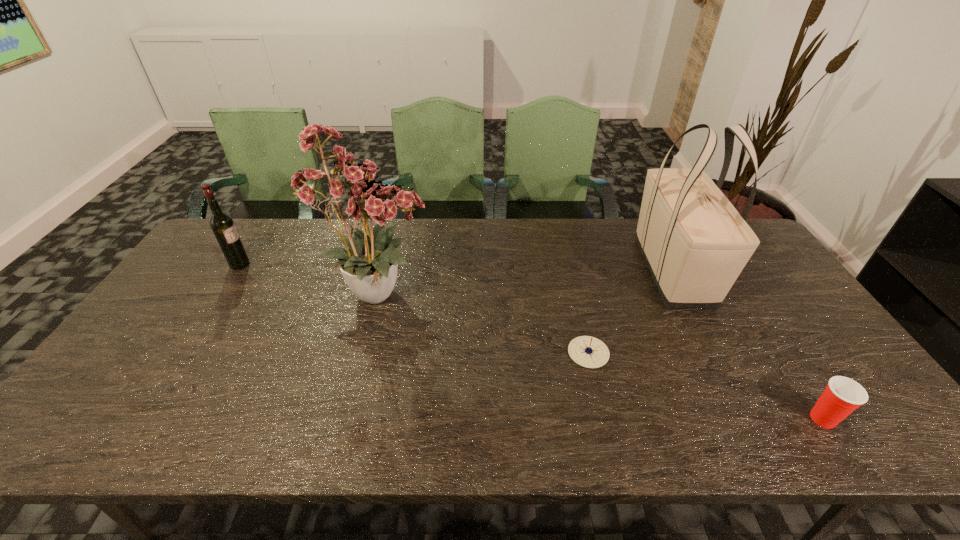
At what (x,y) coordinates should I click in order to perform the action: click on unoccupied position between the third object from left to right and the shopping bag. Please return your answer as a coordinate pair (x, y). The height and width of the screenshot is (540, 960). Looking at the image, I should click on (631, 312).

Identify the location of unoccupied position between the leftmost object and the shopping bag. (456, 268).

Find the location of a particular element. Image resolution: width=960 pixels, height=540 pixels. vacant area that lies between the flower arrangement and the second object from right to left is located at coordinates (527, 282).

Identify which object is located as the third nearest to the flower arrangement. Please provide its 2D coordinates. Your answer should be formatted as a tuple, i.e. [(x, y)], where the tuple contains the x and y coordinates of a point satisfying the conditions above.

[(695, 243)]

Image resolution: width=960 pixels, height=540 pixels. What are the coordinates of `object that is the third closest one to the leftmost object` in the screenshot? It's located at (695, 243).

Image resolution: width=960 pixels, height=540 pixels. Identify the location of free space that satisfies the following two spatial constraints: 1. on the front and back of the compass; 2. on the right side of the third shortest object. (183, 353).

This screenshot has height=540, width=960. Find the location of `free spot that satisfies the following two spatial constraints: 1. on the back side of the shortest object; 2. on the front and back of the wine bottle`. free spot that satisfies the following two spatial constraints: 1. on the back side of the shortest object; 2. on the front and back of the wine bottle is located at coordinates (567, 265).

Where is `vacant region that satisfies the following two spatial constraints: 1. on the front-facing side of the compass; 2. on the left side of the flower arrangement`? vacant region that satisfies the following two spatial constraints: 1. on the front-facing side of the compass; 2. on the left side of the flower arrangement is located at coordinates [366, 353].

Identify the location of vacant point that satisfies the following two spatial constraints: 1. with handles facing forward on the second shortest object; 2. on the left side of the shopping bag. The width and height of the screenshot is (960, 540). click(748, 418).

What are the coordinates of `blank space that satisfies the following two spatial constraints: 1. on the front and back of the third object from left to right; 2. on the left side of the wine bottle` in the screenshot? It's located at (183, 353).